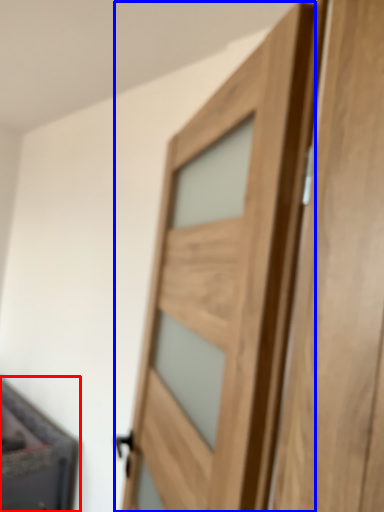
Question: Which object is further to the camera taking this photo, cabinetry (highlighted by a red box) or door (highlighted by a blue box)?

Choices:
 (A) cabinetry
 (B) door

Answer: (A)